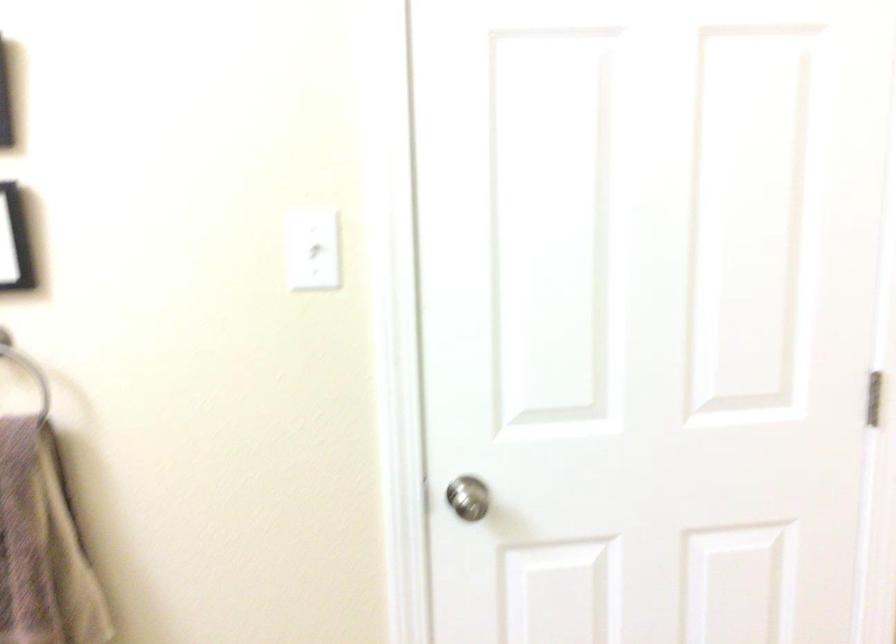
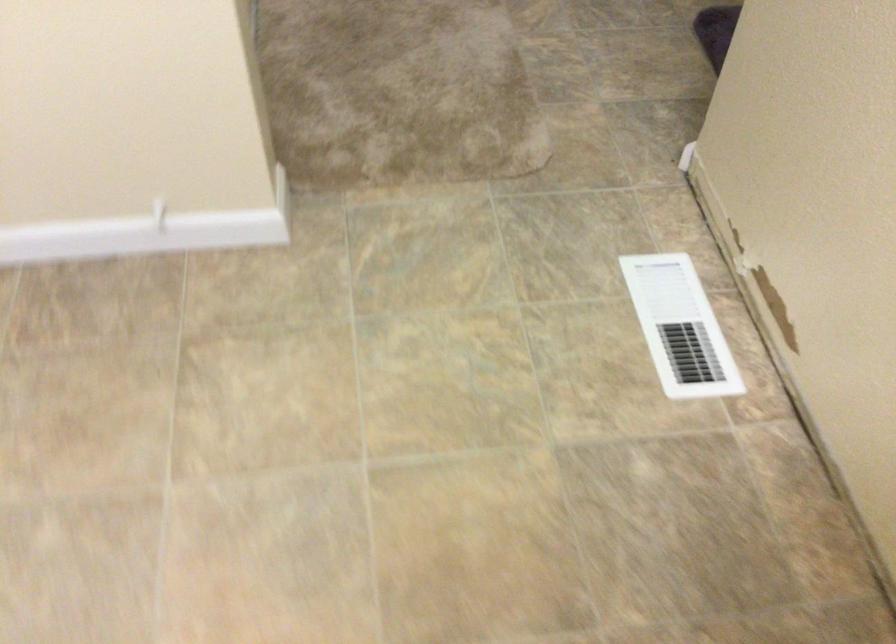
Based on the continuous images, in which direction is the camera rotating?

The camera rotated toward right-down.